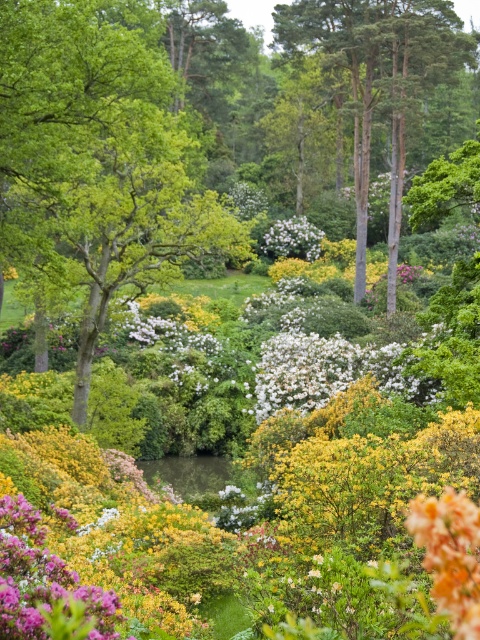
You are a gardener standing at the edge of the garden near the orange textured flower at lower right, and you need to water the smooth bark tree at upper center. Given that your hose can reach up to 60 meters, will you be able to water the tree without moving the hose? Please explain your reasoning based on the distance between them.

The smooth bark tree at upper center is 63.59 meters away from the orange textured flower at lower right. Since the hose can only reach up to 60 meters, the gardener will not be able to water the tree without moving the hose, as the distance exceeds the hose length.

You are a gardener who wants to plant a new flower between the smooth bark tree at upper center and the orange textured flower at lower right. Based on their positions, where should you place the new flower?

Since the smooth bark tree at upper center is located above the orange textured flower at lower right, you should plant the new flower in between them along the vertical axis, placing it somewhere between the upper center and lower right positions.